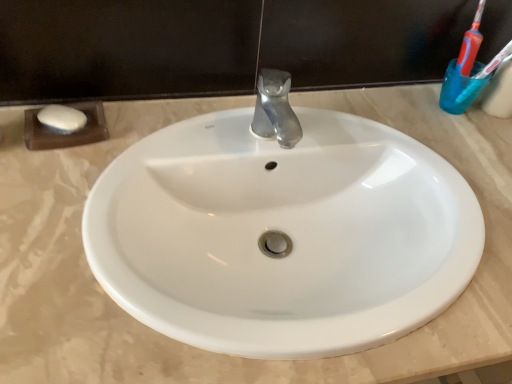
Question: Is translucent plastic toothbrush at upper right further to camera compared to transparent plastic cup at upper right?

Choices:
 (A) yes
 (B) no

Answer: (B)

Question: Is translucent plastic toothbrush at upper right at the right side of transparent plastic cup at upper right?

Choices:
 (A) no
 (B) yes

Answer: (B)

Question: From a real-world perspective, does translucent plastic toothbrush at upper right stand above transparent plastic cup at upper right?

Choices:
 (A) yes
 (B) no

Answer: (A)

Question: Does translucent plastic toothbrush at upper right turn towards transparent plastic cup at upper right?

Choices:
 (A) yes
 (B) no

Answer: (B)

Question: Considering the relative sizes of translucent plastic toothbrush at upper right and transparent plastic cup at upper right in the image provided, is translucent plastic toothbrush at upper right shorter than transparent plastic cup at upper right?

Choices:
 (A) no
 (B) yes

Answer: (A)

Question: Is translucent plastic toothbrush at upper right bigger or smaller than transparent plastic cup at upper right?

Choices:
 (A) big
 (B) small

Answer: (A)

Question: From the image's perspective, is translucent plastic toothbrush at upper right positioned above or below transparent plastic cup at upper right?

Choices:
 (A) below
 (B) above

Answer: (B)

Question: Is point (463, 92) closer or farther from the camera than point (479, 64)?

Choices:
 (A) closer
 (B) farther

Answer: (A)

Question: Considering the relative positions of translucent plastic toothbrush at upper right and transparent plastic cup at upper right in the image provided, is translucent plastic toothbrush at upper right to the left or to the right of transparent plastic cup at upper right?

Choices:
 (A) left
 (B) right

Answer: (B)

Question: From a real-world perspective, relative to transparent plastic cup at upper right, is white glossy sink at center vertically above or below?

Choices:
 (A) below
 (B) above

Answer: (A)

Question: Is white glossy sink at center wider or thinner than transparent plastic cup at upper right?

Choices:
 (A) wide
 (B) thin

Answer: (A)

Question: In the image, is white glossy sink at center on the left side or the right side of transparent plastic cup at upper right?

Choices:
 (A) left
 (B) right

Answer: (A)

Question: Choose the correct answer: Is white glossy sink at center inside transparent plastic cup at upper right or outside it?

Choices:
 (A) inside
 (B) outside

Answer: (B)

Question: Looking at the image, does white glossy sink at center seem bigger or smaller compared to translucent plastic toothbrush at upper right?

Choices:
 (A) big
 (B) small

Answer: (A)

Question: From the image's perspective, relative to translucent plastic toothbrush at upper right, is white glossy sink at center above or below?

Choices:
 (A) below
 (B) above

Answer: (A)